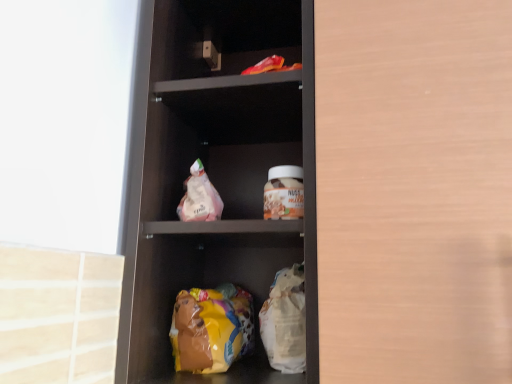
Question: Is matte plastic shelf at center wider or thinner than matte brown glass jar at center?

Choices:
 (A) thin
 (B) wide

Answer: (B)

Question: From their relative heights in the image, would you say matte plastic shelf at center is taller or shorter than matte brown glass jar at center?

Choices:
 (A) tall
 (B) short

Answer: (A)

Question: Which object is positioned closest to the matte plastic shelf at center?

Choices:
 (A) yellow plastic bag at lower center
 (B) matte brown glass jar at center
 (C) wooden cabinet door at right
 (D) translucent plastic bag at center

Answer: (D)

Question: Which object is positioned farthest from the matte brown glass jar at center?

Choices:
 (A) matte plastic shelf at center
 (B) yellow plastic bag at lower center
 (C) translucent plastic bag at center
 (D) wooden cabinet door at right

Answer: (B)